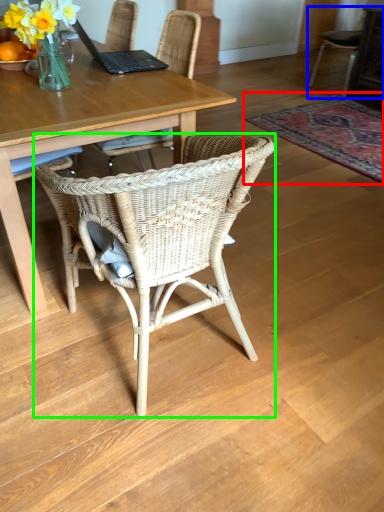
Question: Based on their relative distances, which object is nearer to mat (highlighted by a red box)? Choose from chair (highlighted by a blue box) and chair (highlighted by a green box).

Choices:
 (A) chair
 (B) chair

Answer: (A)